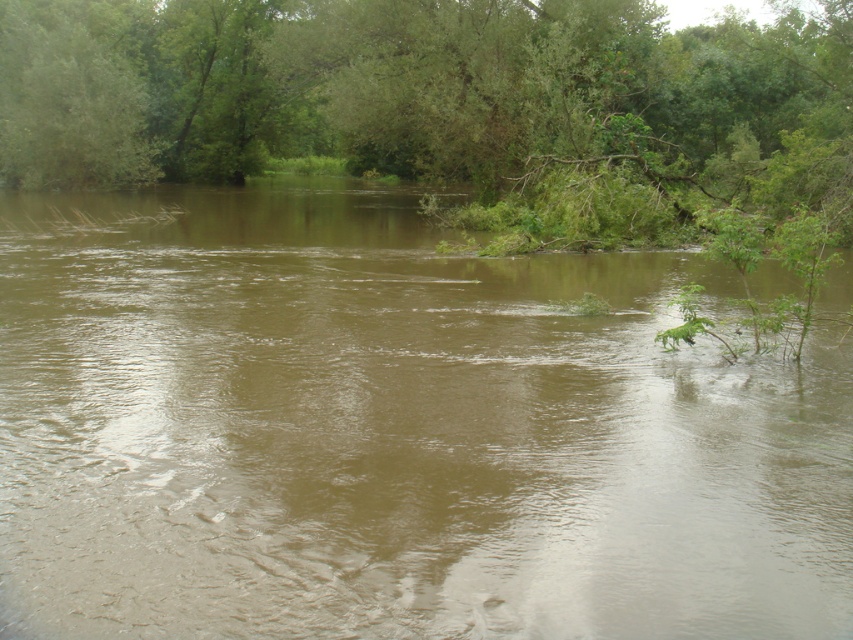
Question: Which object is closer to the camera taking this photo?

Choices:
 (A) brown muddy water at center
 (B) green leafy tree at upper center

Answer: (A)

Question: Where is brown muddy water at center located in relation to green leafy tree at upper center in the image?

Choices:
 (A) below
 (B) above

Answer: (A)

Question: Where is brown muddy water at center located in relation to green leafy tree at upper center in the image?

Choices:
 (A) right
 (B) left

Answer: (B)

Question: From the image, what is the correct spatial relationship of brown muddy water at center in relation to green leafy tree at upper center?

Choices:
 (A) above
 (B) below

Answer: (B)